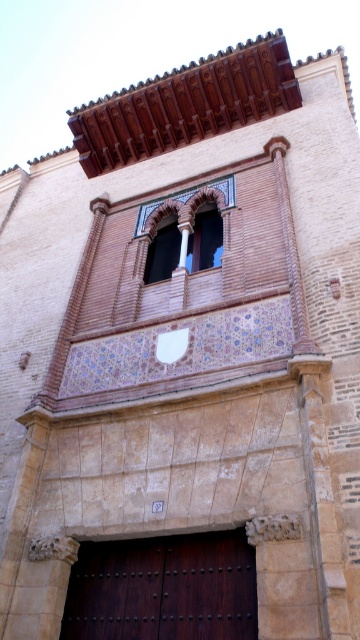
Question: Which point is closer to the camera taking this photo?

Choices:
 (A) (146, 602)
 (B) (163, 276)

Answer: (A)

Question: Can you confirm if dark brown wood at center is positioned below terracotta brick window at center?

Choices:
 (A) yes
 (B) no

Answer: (A)

Question: Is dark brown wood at center further to the viewer compared to terracotta brick window at center?

Choices:
 (A) no
 (B) yes

Answer: (A)

Question: Which point appears farthest from the camera in this image?

Choices:
 (A) (165, 278)
 (B) (73, 605)

Answer: (A)

Question: Which point is closer to the camera?

Choices:
 (A) (200, 209)
 (B) (173, 627)

Answer: (B)

Question: Is dark brown wood at center above terracotta brick window at center?

Choices:
 (A) no
 (B) yes

Answer: (A)